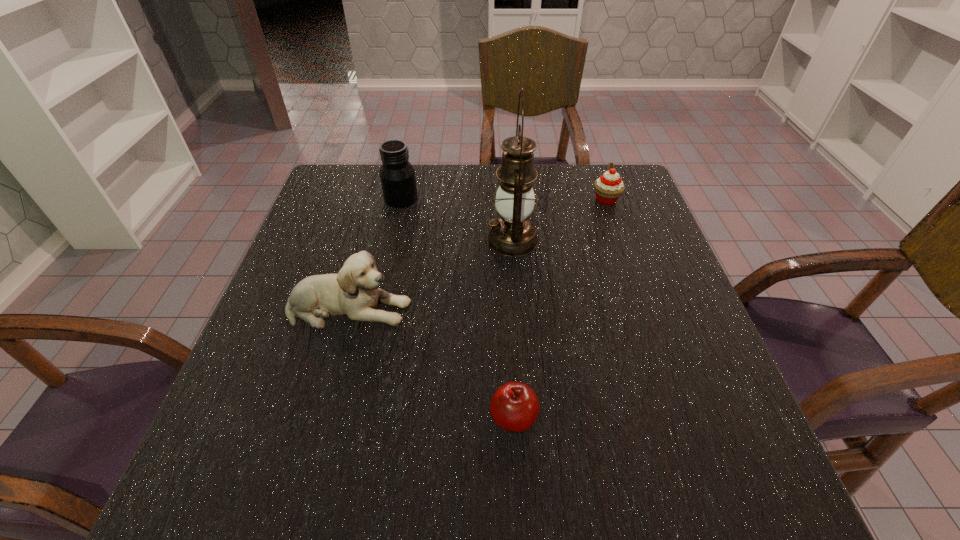
Identify the location of free space between the rightmost object and the nearest object. The image size is (960, 540). (560, 309).

I want to click on free space between the shortest object and the rightmost object, so click(560, 309).

Point out which object is positioned as the third nearest to the third farthest object. Please provide its 2D coordinates. Your answer should be formatted as a tuple, i.e. [(x, y)], where the tuple contains the x and y coordinates of a point satisfying the conditions above.

[(397, 175)]

Find the location of a particular element. object that stands as the closest to the shortest object is located at coordinates (354, 292).

You are a GUI agent. You are given a task and a screenshot of the screen. Output one action in this format:
    pyautogui.click(x=<x>, y=<y>)
    Task: Click on the free space that satisfies the following two spatial constraints: 1. on the front side of the oil lamp; 2. on the front-facing side of the puppy
    This screenshot has width=960, height=540.
    Given the screenshot: What is the action you would take?
    517,308

Locate an element on the screen. vacant space that satisfies the following two spatial constraints: 1. on the front side of the jar; 2. on the left side of the third nearest object is located at coordinates (392, 240).

The height and width of the screenshot is (540, 960). In order to click on blank area in the image that satisfies the following two spatial constraints: 1. on the back side of the nearest object; 2. on the left side of the third nearest object in this screenshot , I will do `click(503, 240)`.

At what (x,y) coordinates should I click in order to perform the action: click on vacant space that satisfies the following two spatial constraints: 1. on the front side of the third farthest object; 2. on the front-facing side of the second nearest object. Please return your answer as a coordinate pair (x, y). Looking at the image, I should click on (517, 308).

This screenshot has width=960, height=540. Identify the location of free spot that satisfies the following two spatial constraints: 1. on the front side of the second tallest object; 2. on the left side of the cupcake. (400, 200).

This screenshot has height=540, width=960. What are the coordinates of `free region that satisfies the following two spatial constraints: 1. on the front side of the oil lamp; 2. on the front-facing side of the fourth farthest object` in the screenshot? It's located at (517, 308).